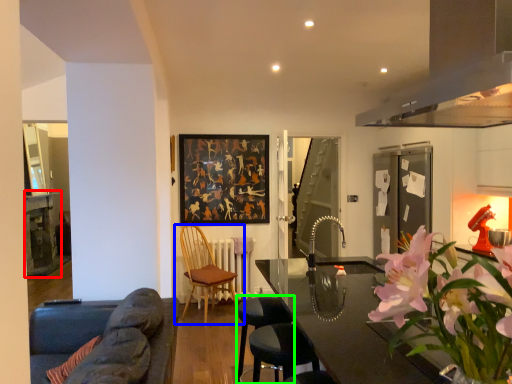
Question: Based on their relative distances, which object is nearer to table (highlighted by a red box)? Choose from chair (highlighted by a blue box) and bar stool (highlighted by a green box).

Choices:
 (A) chair
 (B) bar stool

Answer: (A)